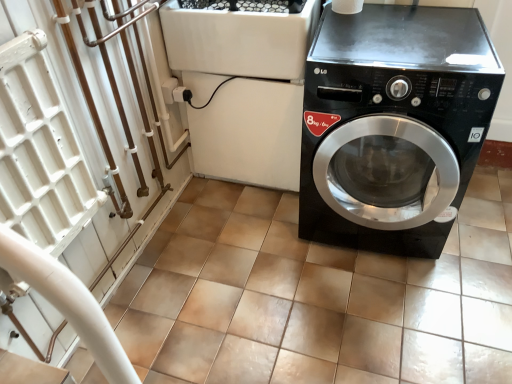
Identify the location of free location in front of black glossy washing machine at right. Image resolution: width=512 pixels, height=384 pixels. (387, 315).